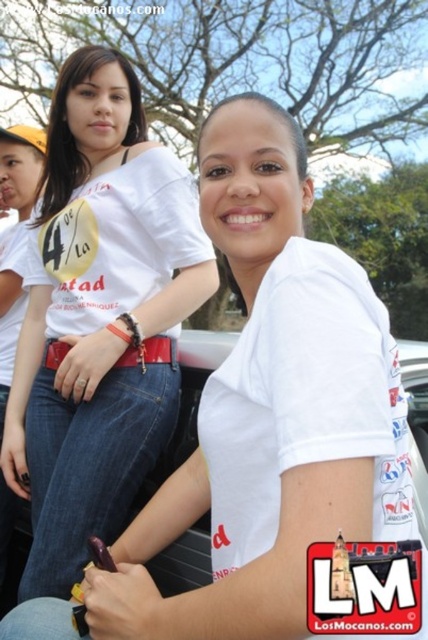
Question: Does white matte t-shirt at center have a smaller size compared to white matte t-shirt at upper left?

Choices:
 (A) no
 (B) yes

Answer: (A)

Question: Is white matte t-shirt at center wider than white matte t-shirt at upper left?

Choices:
 (A) no
 (B) yes

Answer: (B)

Question: Which object is farther from the camera taking this photo?

Choices:
 (A) white matte t-shirt at center
 (B) white matte t-shirt at upper left

Answer: (B)

Question: Is white matte t-shirt at center in front of white matte t-shirt at upper left?

Choices:
 (A) yes
 (B) no

Answer: (A)

Question: Which of the following is the farthest from the observer?

Choices:
 (A) (3, 525)
 (B) (124, 365)

Answer: (A)